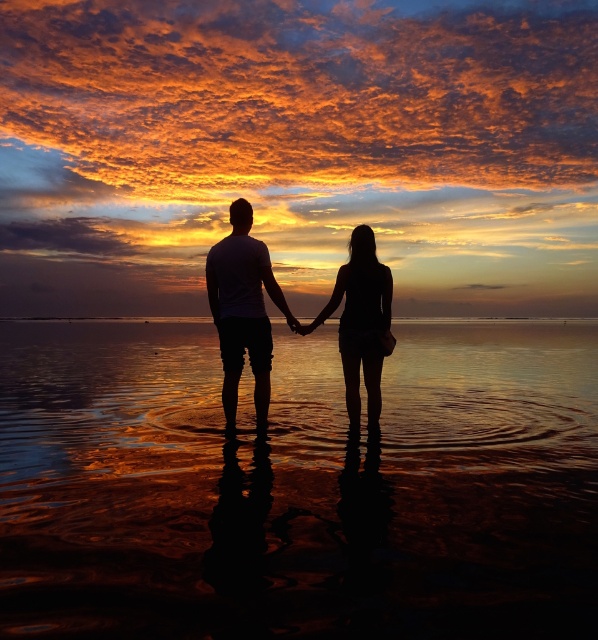
Question: Which object appears closest to the camera in this image?

Choices:
 (A) reflective wet sand at center
 (B) black matte shorts at center
 (C) silhouette couple at center

Answer: (A)

Question: Among these points, which one is nearest to the camera?

Choices:
 (A) click(227, 262)
 (B) click(257, 634)
 (C) click(361, 337)
 (D) click(371, 412)

Answer: (B)

Question: Estimate the real-world distances between objects in this image. Which object is closer to the matte white t-shirt at center?

Choices:
 (A) black matte shorts at center
 (B) reflective wet sand at center

Answer: (A)

Question: Observing the image, what is the correct spatial positioning of silhouette couple at center in reference to black matte shorts at center?

Choices:
 (A) left
 (B) right

Answer: (A)

Question: Is reflective wet sand at center above black matte shorts at center?

Choices:
 (A) yes
 (B) no

Answer: (B)

Question: From the image, what is the correct spatial relationship of silhouette couple at center in relation to black matte shorts at center?

Choices:
 (A) below
 (B) above

Answer: (B)